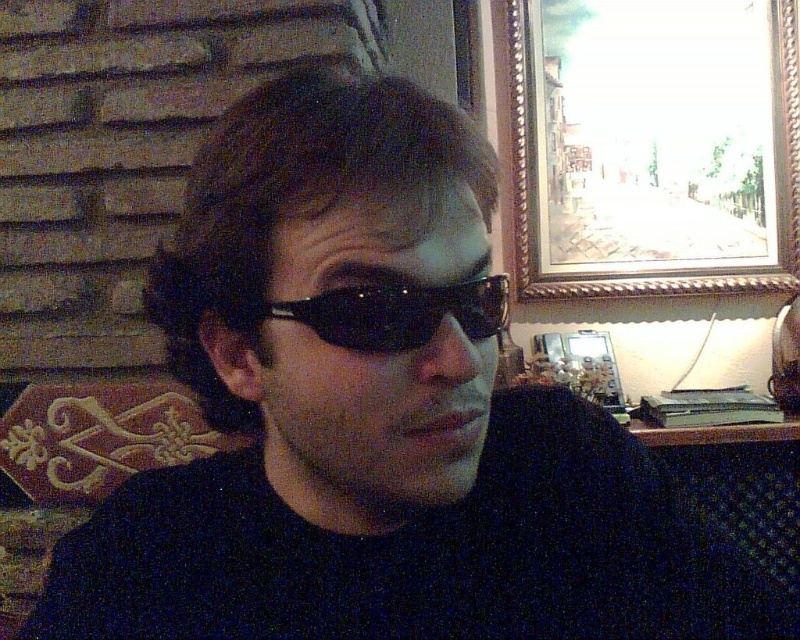
Can you confirm if gold/gilded picture frame at upper right is thinner than black plastic goggles at center?

Incorrect, gold/gilded picture frame at upper right's width is not less than black plastic goggles at center's.

Which is more to the left, gold/gilded picture frame at upper right or black plastic goggles at center?

black plastic goggles at center is more to the left.

Where is `gold/gilded picture frame at upper right`? gold/gilded picture frame at upper right is located at coordinates (654, 145).